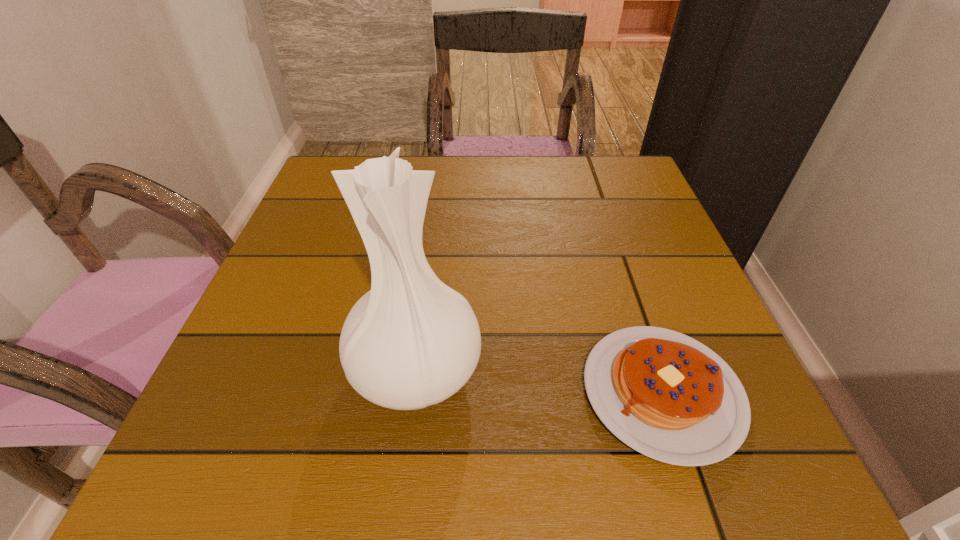
The width and height of the screenshot is (960, 540). What are the coordinates of `vase` in the screenshot? It's located at (410, 342).

Locate an element on the screen. The width and height of the screenshot is (960, 540). the taller object is located at coordinates (410, 342).

The height and width of the screenshot is (540, 960). I want to click on the shorter object, so click(x=666, y=395).

Find the location of `the right object`. the right object is located at coordinates (666, 395).

Find the location of a particular element. The height and width of the screenshot is (540, 960). vacant space located on the left of the left object is located at coordinates (245, 368).

Locate an element on the screen. free spot located on the back of the shorter object is located at coordinates (626, 286).

The width and height of the screenshot is (960, 540). I want to click on vase situated at the near edge, so click(x=410, y=342).

Identify the location of pancake located at the near edge. pyautogui.click(x=666, y=395).

Identify the location of object that is positioned at the right edge. The width and height of the screenshot is (960, 540). (666, 395).

Where is `object at the near right corner`? This screenshot has height=540, width=960. object at the near right corner is located at coordinates coord(666,395).